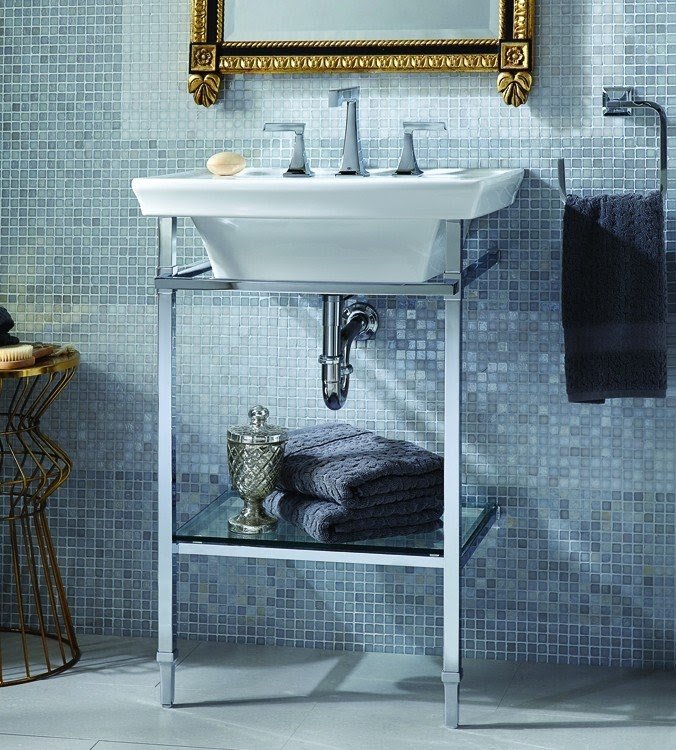
Locate an element on the screen. stand is located at coordinates (158, 291).